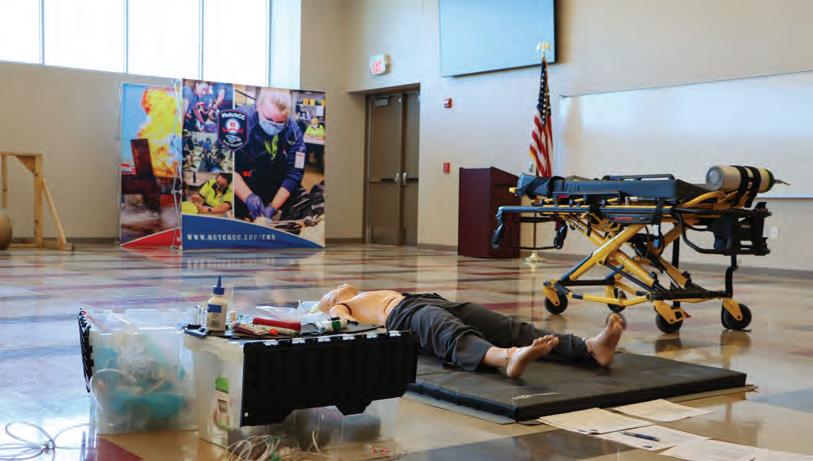
Identify the location of gurney. (667, 196).